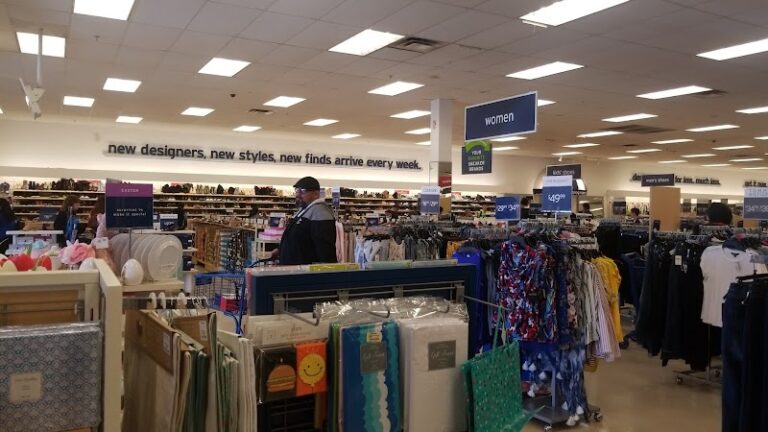
Image resolution: width=768 pixels, height=432 pixels. What are the coordinates of `floor` in the screenshot? It's located at (666, 375).